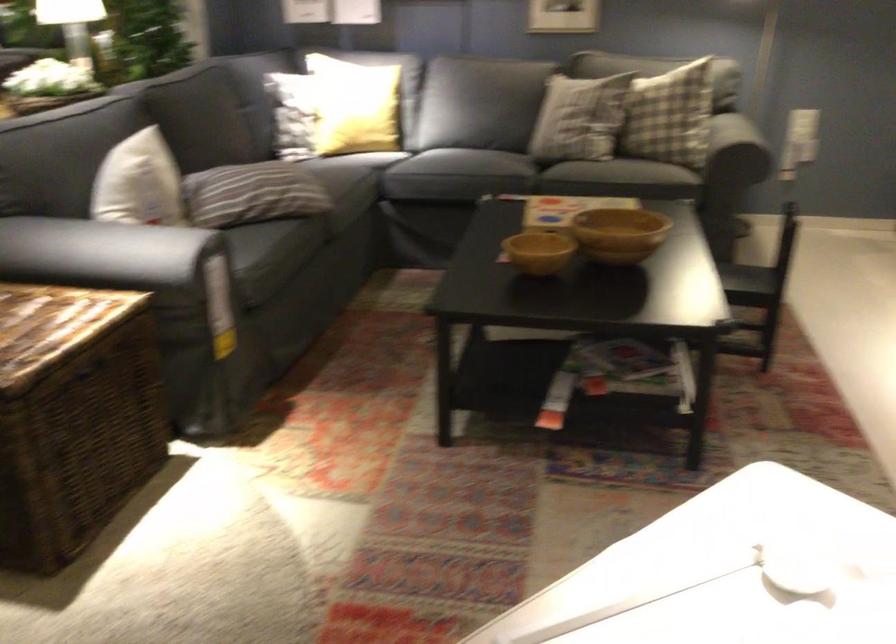
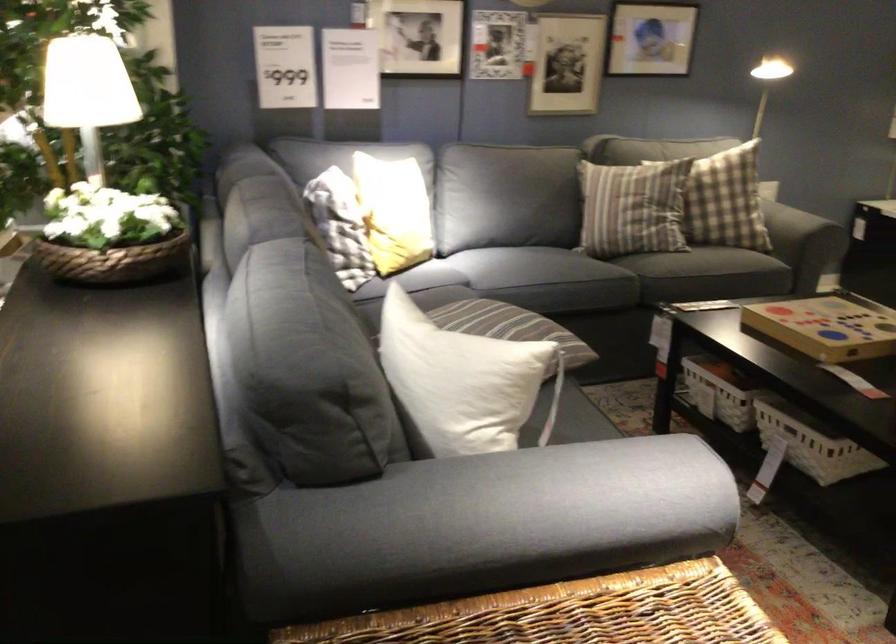
In the second image, find the point that corresponds to (644,136) in the first image.

(798, 223)